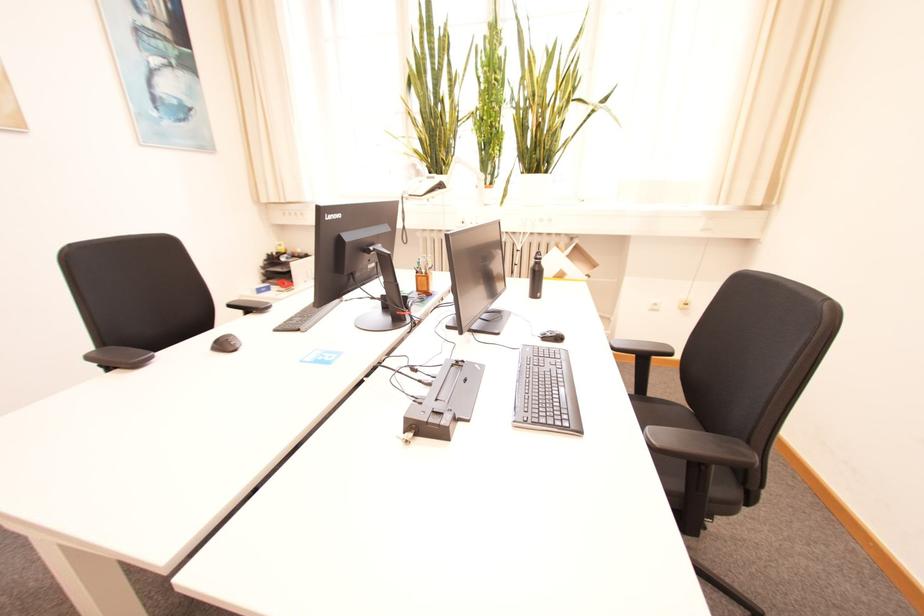
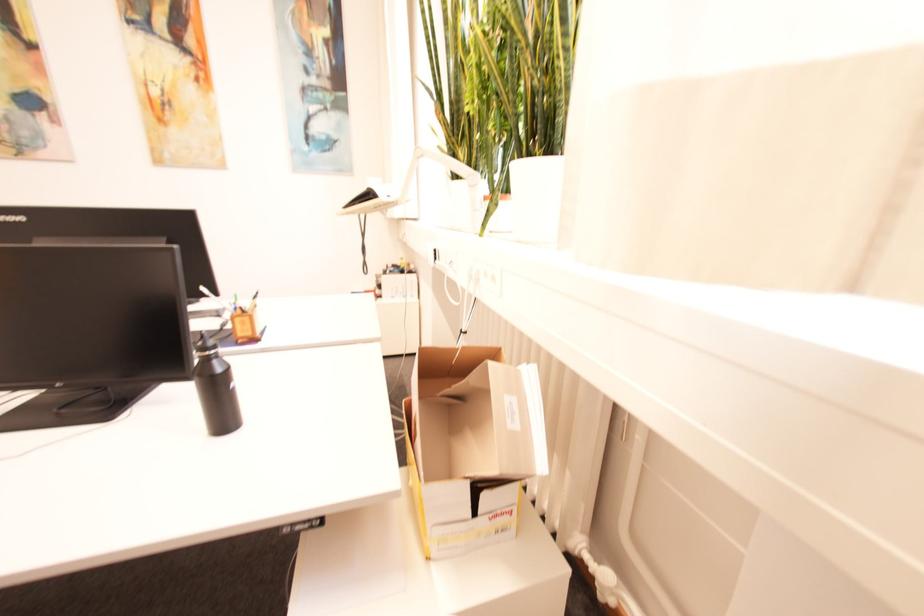
Locate, in the second image, the point that corresponds to [446,182] in the first image.

(375, 188)